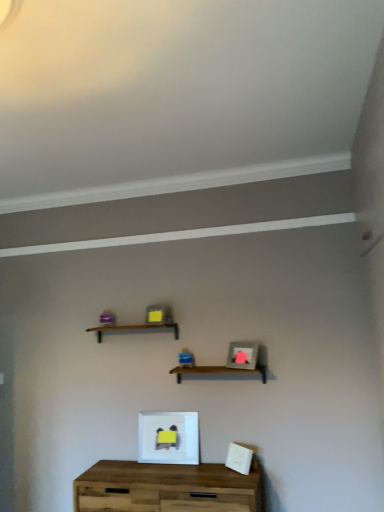
The height and width of the screenshot is (512, 384). I want to click on wooden at center, the 2th shelf positioned from the top, so click(x=217, y=371).

The image size is (384, 512). I want to click on wooden at center, arranged as the first shelf when ordered from the bottom, so click(x=217, y=371).

Find the location of a particular element. The width and height of the screenshot is (384, 512). the 2nd picture frame located above the wooden table at center (from a real-world perspective) is located at coordinates (243, 355).

Is wooden table at center wider or thinner than matte gray picture frame at center, acting as the second picture frame starting from the bottom?

wooden table at center is wider than matte gray picture frame at center, acting as the second picture frame starting from the bottom.

Is wooden table at center oriented away from matte gray picture frame at center, which is counted as the second picture frame, starting from the left?

wooden table at center is not turned away from matte gray picture frame at center, which is counted as the second picture frame, starting from the left.

Can you tell me how much wooden table at center and matte gray picture frame at center, positioned as the first picture frame in right-to-left order, differ in facing direction?

The angle between the facing direction of wooden table at center and the facing direction of matte gray picture frame at center, positioned as the first picture frame in right-to-left order, is 27.9 degrees.

From a real-world perspective, which is physically above, wooden table at center or wooden at center, the 2th shelf positioned from the top?

From a 3D spatial view, wooden at center, the 2th shelf positioned from the top, is above.

Is wooden table at center taller or shorter than wooden at center, the 2th shelf from the left?

Considering their sizes, wooden table at center has more height than wooden at center, the 2th shelf from the left.

Looking at the image, does wooden table at center seem bigger or smaller compared to wooden at center, which is counted as the first shelf, starting from the right?

Considering their sizes, wooden table at center takes up more space than wooden at center, which is counted as the first shelf, starting from the right.

How different are the orientations of wooden table at center and wooden at center, which is counted as the first shelf, starting from the right, in degrees?

0.207 degrees separate the facing orientations of wooden table at center and wooden at center, which is counted as the first shelf, starting from the right.

Is the depth of wooden table at center greater than that of wooden shelf at center, marked as the second shelf in a bottom-to-top arrangement?

No, wooden table at center is in front of wooden shelf at center, marked as the second shelf in a bottom-to-top arrangement.

From the image's perspective, is wooden table at center on wooden shelf at center, which is the 1th shelf from left to right?

No, from the image's perspective, wooden table at center is not over wooden shelf at center, which is the 1th shelf from left to right.

Would you consider wooden table at center to be distant from wooden shelf at center, positioned as the second shelf in right-to-left order?

No, wooden table at center is in close proximity to wooden shelf at center, positioned as the second shelf in right-to-left order.

Considering the positions of objects wooden table at center and wooden shelf at center, which is the 1th shelf from left to right, in the image provided, who is more to the right, wooden table at center or wooden shelf at center, which is the 1th shelf from left to right,?

From the viewer's perspective, wooden table at center appears more on the right side.

Is wooden shelf at center, acting as the first shelf starting from the top, oriented away from wooden table at center?

wooden shelf at center, acting as the first shelf starting from the top, is not turned away from wooden table at center.

In the scene shown: Is the depth of wooden shelf at center, acting as the first shelf starting from the top, less than that of wooden table at center?

No, wooden shelf at center, acting as the first shelf starting from the top, is further to the viewer.

Considering the sizes of wooden shelf at center, acting as the first shelf starting from the top, and wooden table at center in the image, is wooden shelf at center, acting as the first shelf starting from the top, wider or thinner than wooden table at center?

wooden shelf at center, acting as the first shelf starting from the top, is thinner than wooden table at center.

Do you think wooden shelf at center, which is the 1th shelf from left to right, is within wooden table at center, or outside of it?

wooden shelf at center, which is the 1th shelf from left to right, is spatially situated outside wooden table at center.

Is wooden table at center looking in the opposite direction of white matte picture frame at center, the 1th picture frame positioned from the left?

wooden table at center is not turned away from white matte picture frame at center, the 1th picture frame positioned from the left.

Identify the location of table below the white matte picture frame at center, the 2th picture frame from the top (from a real-world perspective). (166, 488).

Which object is positioned more to the left, wooden table at center or white matte picture frame at center, which ranks as the first picture frame in bottom-to-top order?

white matte picture frame at center, which ranks as the first picture frame in bottom-to-top order, is more to the left.

From the image's perspective, is wooden table at center located above or below white matte picture frame at center, which ranks as the first picture frame in bottom-to-top order?

Clearly, from the image's perspective, wooden table at center is below white matte picture frame at center, which ranks as the first picture frame in bottom-to-top order.

Considering the relative sizes of white matte picture frame at center, marked as the second picture frame in a right-to-left arrangement, and wooden table at center in the image provided, is white matte picture frame at center, marked as the second picture frame in a right-to-left arrangement, shorter than wooden table at center?

Correct, white matte picture frame at center, marked as the second picture frame in a right-to-left arrangement, is not as tall as wooden table at center.

Can you tell me how much white matte picture frame at center, marked as the second picture frame in a right-to-left arrangement, and wooden table at center differ in facing direction?

0.826 degrees.

Is white matte picture frame at center, marked as the second picture frame in a right-to-left arrangement, surrounding wooden table at center?

No, white matte picture frame at center, marked as the second picture frame in a right-to-left arrangement, does not contain wooden table at center.

Is matte gray picture frame at center, the 1th picture frame when ordered from top to bottom, placed right next to wooden table at center?

No, matte gray picture frame at center, the 1th picture frame when ordered from top to bottom, is not with wooden table at center.

Which object is further away from the camera taking this photo, matte gray picture frame at center, the 1th picture frame when ordered from top to bottom, or wooden table at center?

Positioned behind is matte gray picture frame at center, the 1th picture frame when ordered from top to bottom.

Can you tell me how much matte gray picture frame at center, the 1th picture frame when ordered from top to bottom, and wooden table at center differ in facing direction?

They differ by 27.9 degrees in their facing directions.

I want to click on the 1st picture frame behind the wooden table at center, counting from the anchor's position, so click(x=243, y=355).

Image resolution: width=384 pixels, height=512 pixels. What are the coordinates of `table located underneath the wooden at center, the 2th shelf from the left (from a real-world perspective)` in the screenshot? It's located at tap(166, 488).

From the image, which object appears to be farther from matte gray picture frame at center, the 1th picture frame when ordered from top to bottom, wooden table at center or wooden at center, the 2th shelf from the left?

wooden table at center is further to matte gray picture frame at center, the 1th picture frame when ordered from top to bottom.

Considering their positions, is matte gray picture frame at center, which is counted as the second picture frame, starting from the left, positioned further to white matte picture frame at center, marked as the second picture frame in a right-to-left arrangement, than wooden shelf at center, positioned as the second shelf in right-to-left order?

Based on the image, wooden shelf at center, positioned as the second shelf in right-to-left order, appears to be further to white matte picture frame at center, marked as the second picture frame in a right-to-left arrangement.

Based on their spatial positions, is wooden shelf at center, acting as the first shelf starting from the top, or wooden at center, arranged as the first shelf when ordered from the bottom, further from matte gray picture frame at center, positioned as the first picture frame in right-to-left order?

Among the two, wooden shelf at center, acting as the first shelf starting from the top, is located further to matte gray picture frame at center, positioned as the first picture frame in right-to-left order.

When comparing their distances from white matte picture frame at center, which ranks as the first picture frame in bottom-to-top order, does wooden shelf at center, positioned as the second shelf in right-to-left order, or wooden table at center seem closer?

wooden table at center is positioned closer to the anchor white matte picture frame at center, which ranks as the first picture frame in bottom-to-top order.

Based on their spatial positions, is matte gray picture frame at center, which is counted as the second picture frame, starting from the left, or wooden table at center further from white matte picture frame at center, marked as the second picture frame in a right-to-left arrangement?

matte gray picture frame at center, which is counted as the second picture frame, starting from the left, lies further to white matte picture frame at center, marked as the second picture frame in a right-to-left arrangement, than the other object.

Looking at the image, which one is located closer to wooden table at center, matte gray picture frame at center, which is counted as the second picture frame, starting from the left, or wooden at center, the 2th shelf from the left?

Among the two, wooden at center, the 2th shelf from the left, is located nearer to wooden table at center.

From the image, which object appears to be farther from wooden shelf at center, positioned as the second shelf in right-to-left order, white matte picture frame at center, which ranks as the first picture frame in bottom-to-top order, or wooden table at center?

wooden table at center is positioned further to the anchor wooden shelf at center, positioned as the second shelf in right-to-left order.

Based on the photo, looking at the image, which one is located closer to wooden at center, which is counted as the first shelf, starting from the right, wooden shelf at center, positioned as the second shelf in right-to-left order, or white matte picture frame at center, the 1th picture frame positioned from the left?

wooden shelf at center, positioned as the second shelf in right-to-left order, lies closer to wooden at center, which is counted as the first shelf, starting from the right, than the other object.

Where is `picture frame between matte gray picture frame at center, positioned as the first picture frame in right-to-left order, and wooden table at center in the up-down direction`? picture frame between matte gray picture frame at center, positioned as the first picture frame in right-to-left order, and wooden table at center in the up-down direction is located at coordinates (168, 437).

What are the coordinates of `shelf between wooden shelf at center, positioned as the second shelf in right-to-left order, and matte gray picture frame at center, which is counted as the second picture frame, starting from the left, in the horizontal direction` in the screenshot? It's located at (217, 371).

This screenshot has width=384, height=512. Find the location of `shelf between matte gray picture frame at center, the 1th picture frame when ordered from top to bottom, and wooden table at center in the up-down direction`. shelf between matte gray picture frame at center, the 1th picture frame when ordered from top to bottom, and wooden table at center in the up-down direction is located at coordinates (217, 371).

Find the location of a particular element. picture frame between wooden at center, the 2th shelf from the left, and wooden table at center, in the vertical direction is located at coordinates (168, 437).